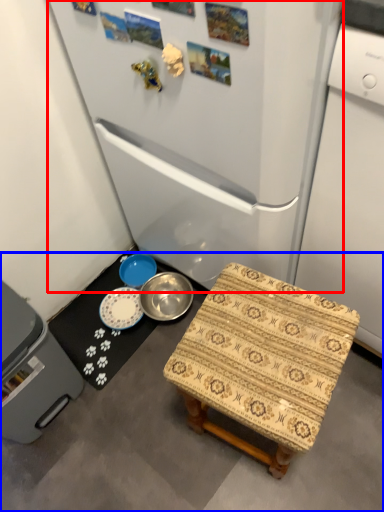
Question: Which object appears farthest to the camera in this image, refrigerator (highlighted by a red box) or concrete (highlighted by a blue box)?

Choices:
 (A) refrigerator
 (B) concrete

Answer: (B)